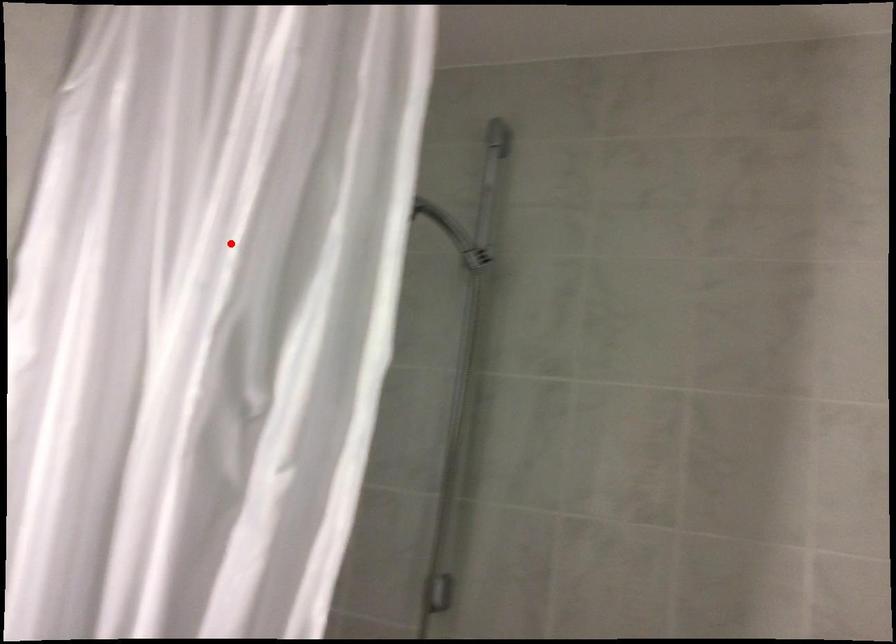
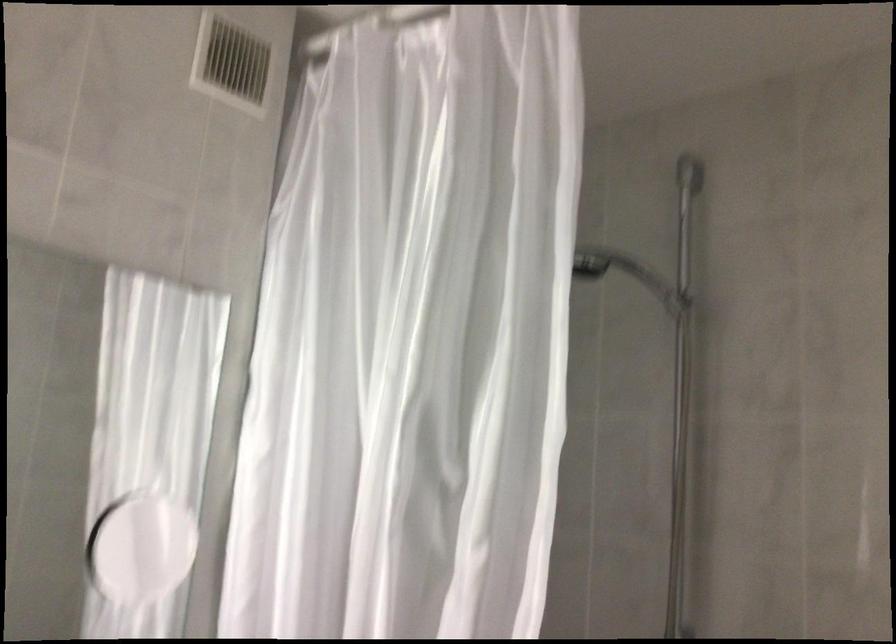
The point at the highlighted location is marked in the first image. Where is the corresponding point in the second image?

(412, 337)